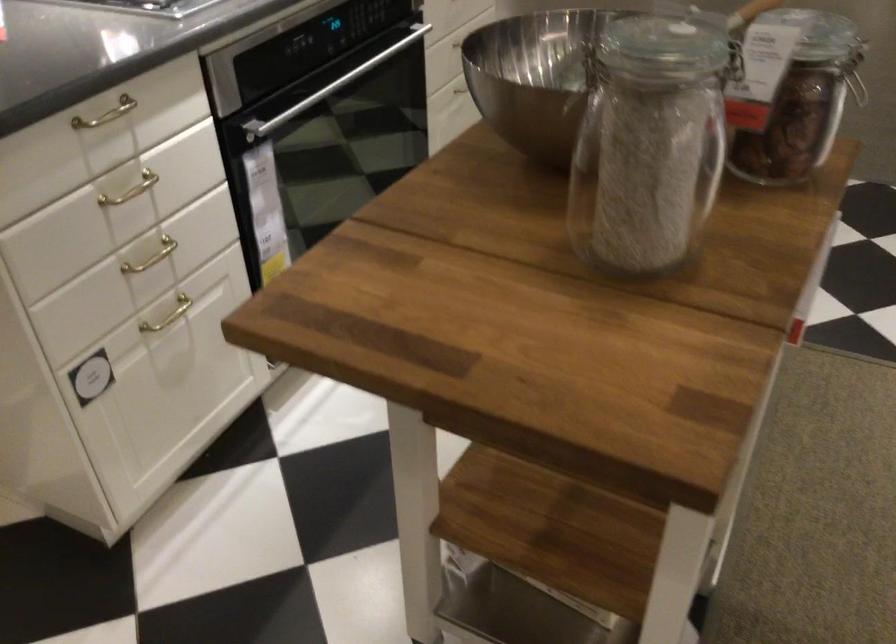
Find the location of `metal mixing bowl`. metal mixing bowl is located at coordinates (535, 77).